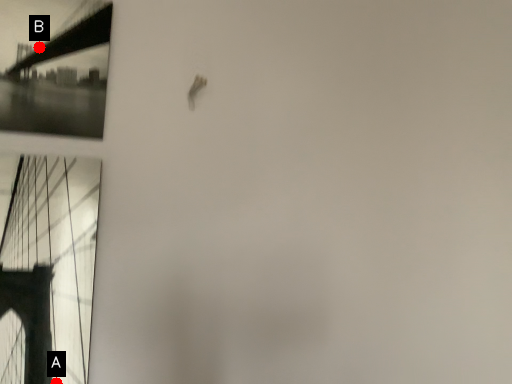
Question: Two points are circled on the image, labeled by A and B beside each circle. Which point is closer to the camera taking this photo?

Choices:
 (A) A is closer
 (B) B is closer

Answer: (A)